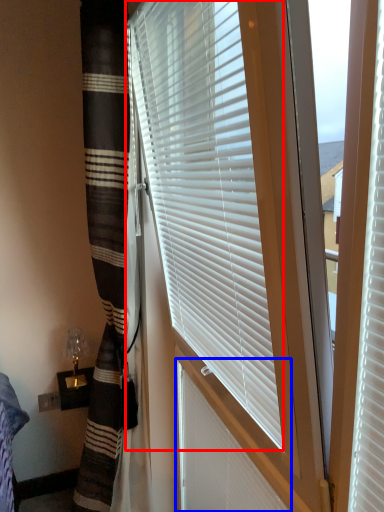
Question: Which object appears closest to the camera in this image, window blind (highlighted by a red box) or shutter (highlighted by a blue box)?

Choices:
 (A) window blind
 (B) shutter

Answer: (A)